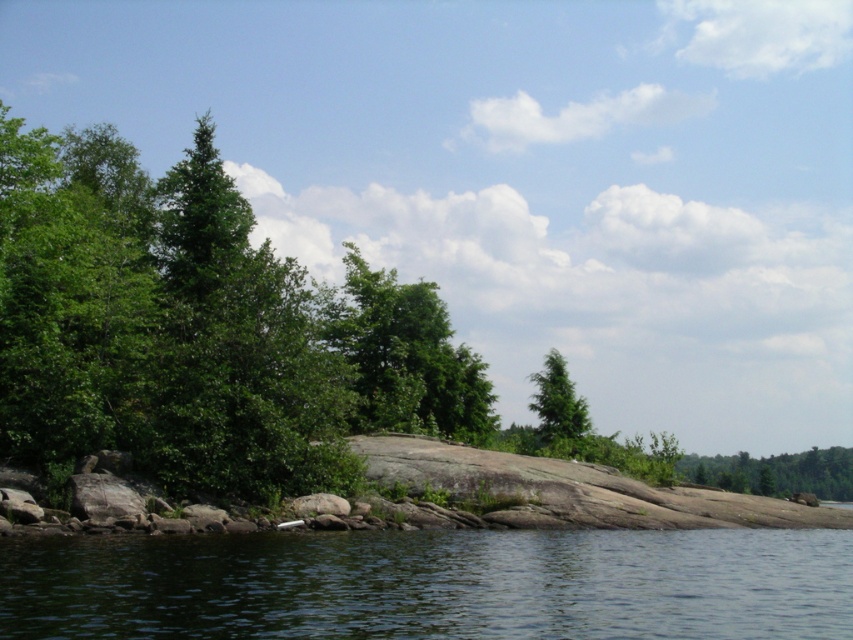
Does transparent water at lower left have a smaller size compared to green matte tree at lower right?

Yes, transparent water at lower left is smaller than green matte tree at lower right.

Can you confirm if transparent water at lower left is positioned above green matte tree at lower right?

Yes, transparent water at lower left is above green matte tree at lower right.

Describe the element at coordinates (431, 584) in the screenshot. I see `transparent water at lower left` at that location.

Identify the location of transparent water at lower left. The height and width of the screenshot is (640, 853). (431, 584).

Is transparent water at lower left behind green matte tree at upper center?

No, transparent water at lower left is closer to the viewer.

Does transparent water at lower left lie in front of green matte tree at upper center?

Yes, it is.

Which is behind, point (836, 579) or point (556, 392)?

The point (556, 392) is behind.

Identify the location of transparent water at lower left. Image resolution: width=853 pixels, height=640 pixels. (431, 584).

Which is below, transparent water at lower left or green leafy tree at center?

transparent water at lower left is below.

Locate an element on the screen. The width and height of the screenshot is (853, 640). transparent water at lower left is located at coordinates (431, 584).

Is point (259, 589) farther from camera compared to point (419, 360)?

No.

You are a GUI agent. You are given a task and a screenshot of the screen. Output one action in this format:
    pyautogui.click(x=<x>, y=<y>)
    Task: Click on the transparent water at lower left
    
    Given the screenshot: What is the action you would take?
    pyautogui.click(x=431, y=584)